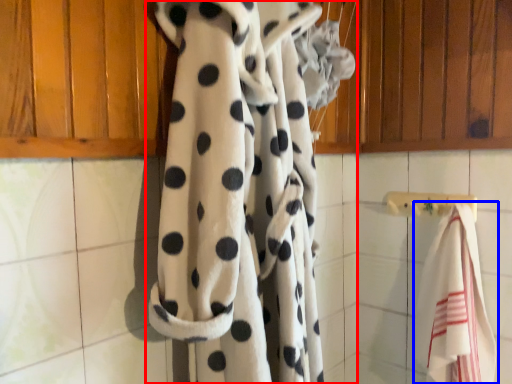
Question: Which object is further to the camera taking this photo, curtain (highlighted by a red box) or towel (highlighted by a blue box)?

Choices:
 (A) curtain
 (B) towel

Answer: (B)